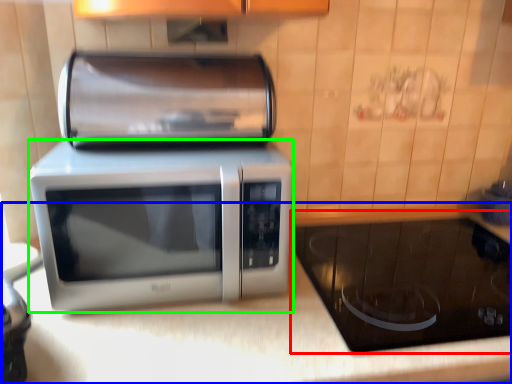
Question: Which is nearer to the appliance (highlighted by a red box)? counter top (highlighted by a blue box) or microwave oven (highlighted by a green box).

Choices:
 (A) counter top
 (B) microwave oven

Answer: (A)